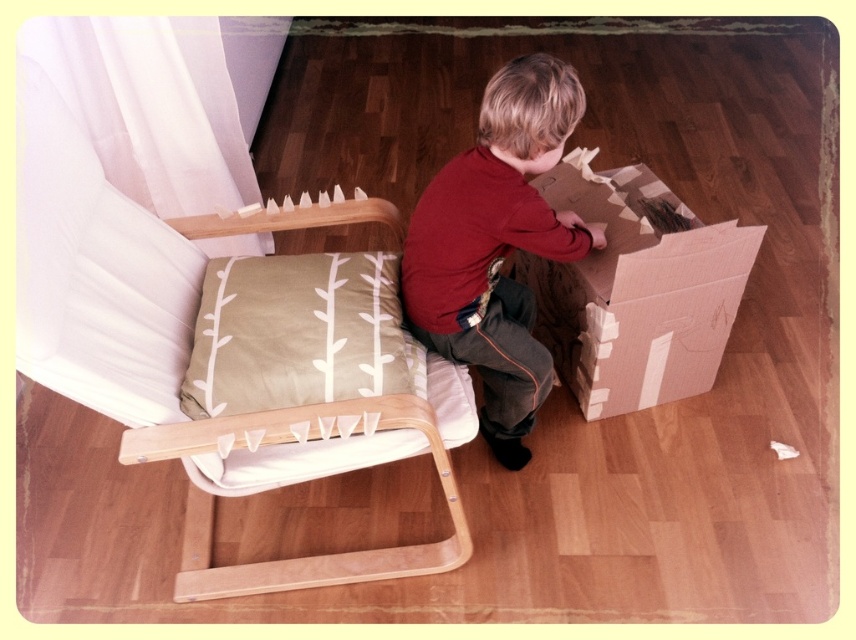
You are a parent trying to decide whether to place a new toy on the floor next to the red cotton shirt at center and the cardboard box at lower right. Which object should you place the toy closer to if you want it to be near the wider object?

The cardboard box at lower right is wider than the red cotton shirt at center, so placing the toy closer to the cardboard box at lower right would position it near the wider object.

Looking at this image, you are a parent trying to decide where to place a new small toy. The wooden cushioned chair at center and the cardboard box at lower right are both in the room. Which object can the toy fit on top of more easily?

The wooden cushioned chair at center is bigger than the cardboard box at lower right, so the toy can fit more easily on the wooden cushioned chair at center.